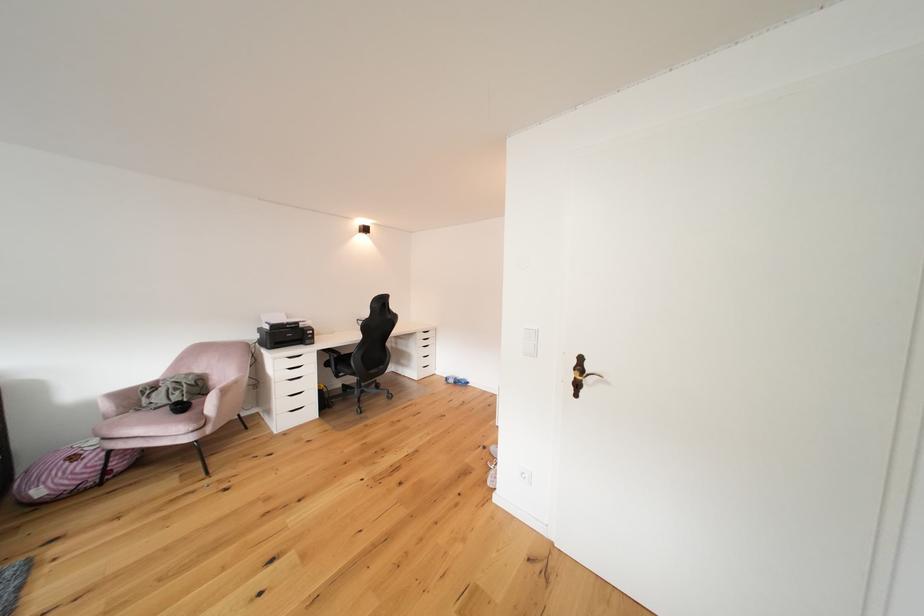
The image size is (924, 616). What do you see at coordinates (370, 354) in the screenshot?
I see `the black chair armrest` at bounding box center [370, 354].